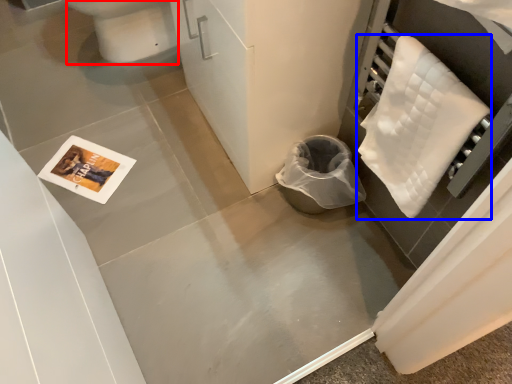
Question: Which object is closer to the camera taking this photo, toilet bowl (highlighted by a red box) or cloth (highlighted by a blue box)?

Choices:
 (A) toilet bowl
 (B) cloth

Answer: (B)